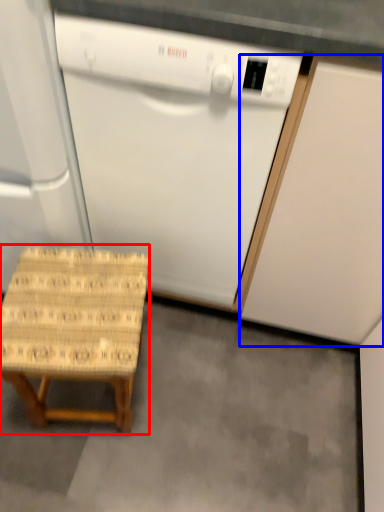
Question: Which point is further to the camera, stool (highlighted by a red box) or cabinetry (highlighted by a blue box)?

Choices:
 (A) stool
 (B) cabinetry

Answer: (A)